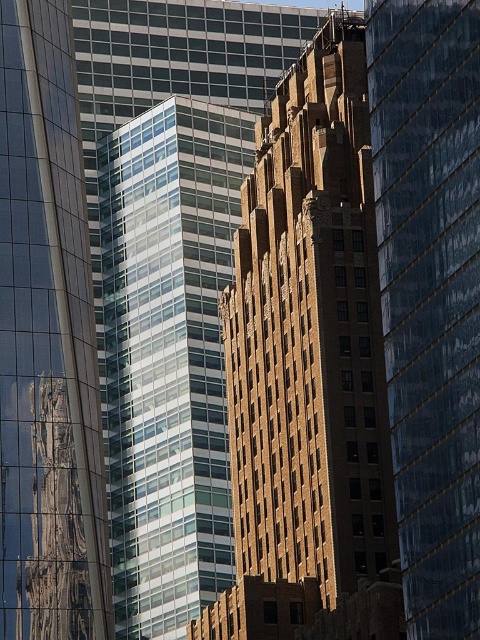
Question: Is brown brick building at center above glassy reflective skyscraper at left?

Choices:
 (A) yes
 (B) no

Answer: (A)

Question: Which point appears closest to the camera in this image?

Choices:
 (A) (415, 515)
 (B) (4, 563)

Answer: (B)

Question: Which point is closer to the camera taking this photo?

Choices:
 (A) (70, 384)
 (B) (396, 518)

Answer: (A)

Question: Is brown brick building at center below glassy reflective skyscraper at left?

Choices:
 (A) yes
 (B) no

Answer: (B)

Question: Does brown brick building at center come in front of glassy reflective skyscraper at left?

Choices:
 (A) no
 (B) yes

Answer: (B)